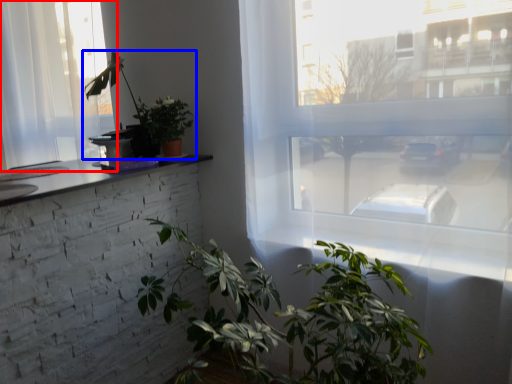
Question: Which of the following is the closest to the observer, window (highlighted by a red box) or houseplant (highlighted by a blue box)?

Choices:
 (A) window
 (B) houseplant

Answer: (B)